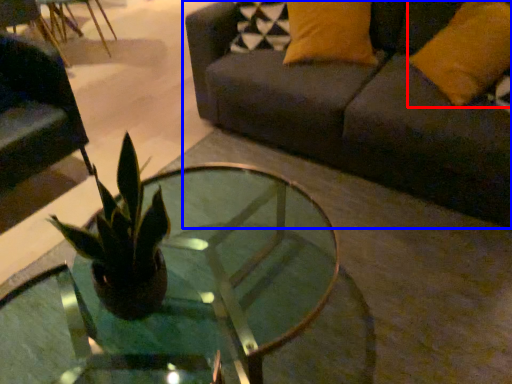
Question: Which object is closer to the camera taking this photo, pillow (highlighted by a red box) or studio couch (highlighted by a blue box)?

Choices:
 (A) pillow
 (B) studio couch

Answer: (B)